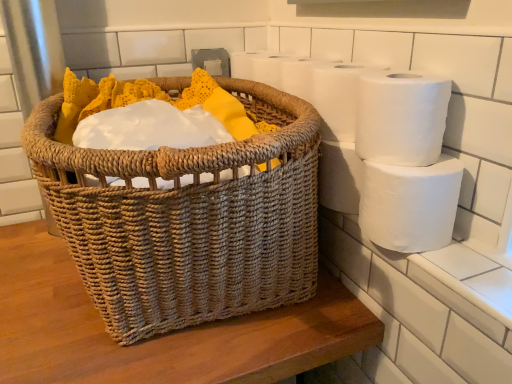
Question: Is white matte toilet paper at right, which is counted as the 1th toilet paper, starting from the bottom, beside woven natural basket at center?

Choices:
 (A) no
 (B) yes

Answer: (A)

Question: Does white matte toilet paper at right, which is counted as the 1th toilet paper, starting from the bottom, have a greater height compared to woven natural basket at center?

Choices:
 (A) no
 (B) yes

Answer: (A)

Question: Can you confirm if white matte toilet paper at right, which is counted as the 1th toilet paper, starting from the bottom, is positioned to the left of woven natural basket at center?

Choices:
 (A) yes
 (B) no

Answer: (B)

Question: Can you confirm if white matte toilet paper at right, which is counted as the 1th toilet paper, starting from the bottom, is thinner than woven natural basket at center?

Choices:
 (A) no
 (B) yes

Answer: (B)

Question: From a real-world perspective, is white matte toilet paper at right, which is counted as the 1th toilet paper, starting from the bottom, on woven natural basket at center?

Choices:
 (A) yes
 (B) no

Answer: (B)

Question: Considering the positions of white matte toilet paper at upper right, the third toilet paper ordered from the bottom, and white matte toilet paper at right, which is the 3th toilet paper from top to bottom, in the image, is white matte toilet paper at upper right, the third toilet paper ordered from the bottom, bigger or smaller than white matte toilet paper at right, which is the 3th toilet paper from top to bottom,?

Choices:
 (A) small
 (B) big

Answer: (A)

Question: In the image, is white matte toilet paper at upper right, the first toilet paper in the top-to-bottom sequence, positioned in front of or behind white matte toilet paper at right, which is the 3th toilet paper from top to bottom?

Choices:
 (A) behind
 (B) front

Answer: (A)

Question: From the image's perspective, is white matte toilet paper at upper right, the first toilet paper in the top-to-bottom sequence, located above or below white matte toilet paper at right, which is the 3th toilet paper from top to bottom?

Choices:
 (A) below
 (B) above

Answer: (B)

Question: Is white matte toilet paper at upper right, the third toilet paper ordered from the bottom, wider or thinner than white matte toilet paper at right, which is counted as the 1th toilet paper, starting from the bottom?

Choices:
 (A) thin
 (B) wide

Answer: (A)

Question: In terms of size, does woven natural basket at center appear bigger or smaller than white matte toilet paper at upper right, the third toilet paper ordered from the bottom?

Choices:
 (A) small
 (B) big

Answer: (B)

Question: From a real-world perspective, is woven natural basket at center physically located above or below white matte toilet paper at upper right, the third toilet paper ordered from the bottom?

Choices:
 (A) above
 (B) below

Answer: (B)

Question: From their relative heights in the image, would you say woven natural basket at center is taller or shorter than white matte toilet paper at upper right, the first toilet paper in the top-to-bottom sequence?

Choices:
 (A) tall
 (B) short

Answer: (A)

Question: From the image's perspective, is woven natural basket at center positioned above or below white matte toilet paper at upper right, the first toilet paper in the top-to-bottom sequence?

Choices:
 (A) above
 (B) below

Answer: (B)

Question: From a real-world perspective, is white matte toilet paper at right, which is counted as the 1th toilet paper, starting from the bottom, physically located above or below white matte toilet paper at upper right, the first toilet paper in the top-to-bottom sequence?

Choices:
 (A) below
 (B) above

Answer: (A)

Question: Considering their positions, is white matte toilet paper at right, which is the 3th toilet paper from top to bottom, located in front of or behind white matte toilet paper at upper right, the first toilet paper in the top-to-bottom sequence?

Choices:
 (A) behind
 (B) front

Answer: (B)